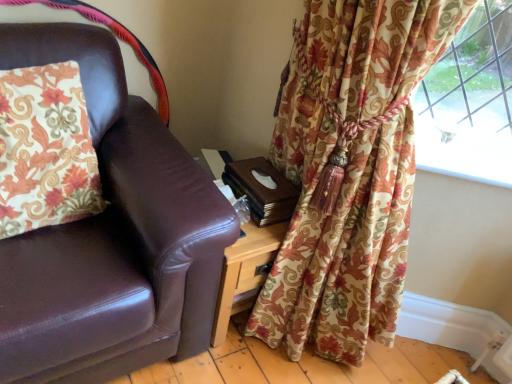
Question: From the image's perspective, is floral fabric pillow at left positioned above or below floral fabric curtain at right?

Choices:
 (A) above
 (B) below

Answer: (A)

Question: Would you say floral fabric pillow at left is to the left or to the right of floral fabric curtain at right in the picture?

Choices:
 (A) left
 (B) right

Answer: (A)

Question: Does point [x=24, y=100] appear closer or farther from the camera than point [x=251, y=334]?

Choices:
 (A) farther
 (B) closer

Answer: (B)

Question: From the image's perspective, is floral fabric curtain at right located above or below floral fabric pillow at left?

Choices:
 (A) below
 (B) above

Answer: (A)

Question: From a real-world perspective, is floral fabric curtain at right physically located above or below floral fabric pillow at left?

Choices:
 (A) above
 (B) below

Answer: (B)

Question: Is floral fabric curtain at right inside the boundaries of floral fabric pillow at left, or outside?

Choices:
 (A) inside
 (B) outside

Answer: (B)

Question: Looking at their shapes, would you say floral fabric curtain at right is wider or thinner than floral fabric pillow at left?

Choices:
 (A) wide
 (B) thin

Answer: (A)